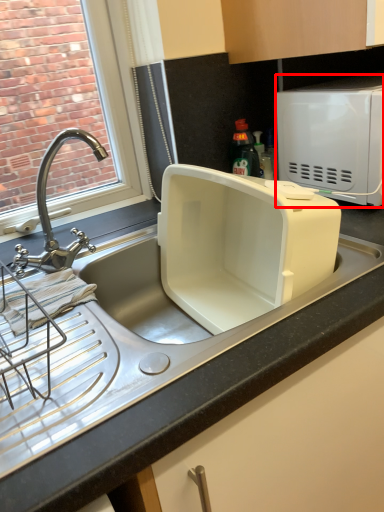
Question: From the image's perspective, considering the relative positions of microwave oven (annotated by the red box) and tap in the image provided, where is microwave oven (annotated by the red box) located with respect to the staircase?

Choices:
 (A) above
 (B) below

Answer: (A)